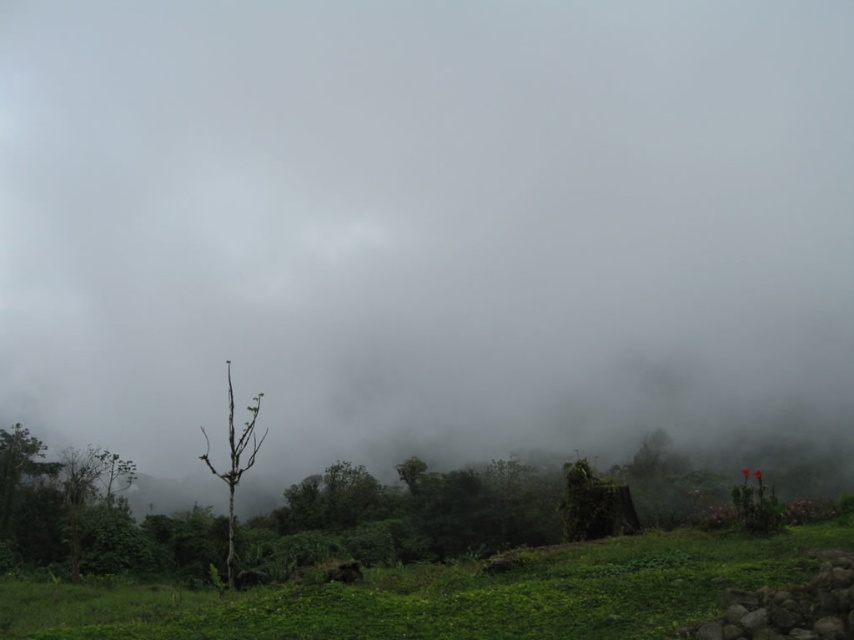
Can you confirm if green leafy grass at lower center is bigger than bare wood tree at center?

No, green leafy grass at lower center is not bigger than bare wood tree at center.

Is green leafy grass at lower center wider than bare wood tree at center?

Yes, green leafy grass at lower center is wider than bare wood tree at center.

Based on the photo, who is more distant from viewer, [846,532] or [246,452]?

Positioned behind is point [246,452].

Locate an element on the screen. green leafy grass at lower center is located at coordinates (447, 595).